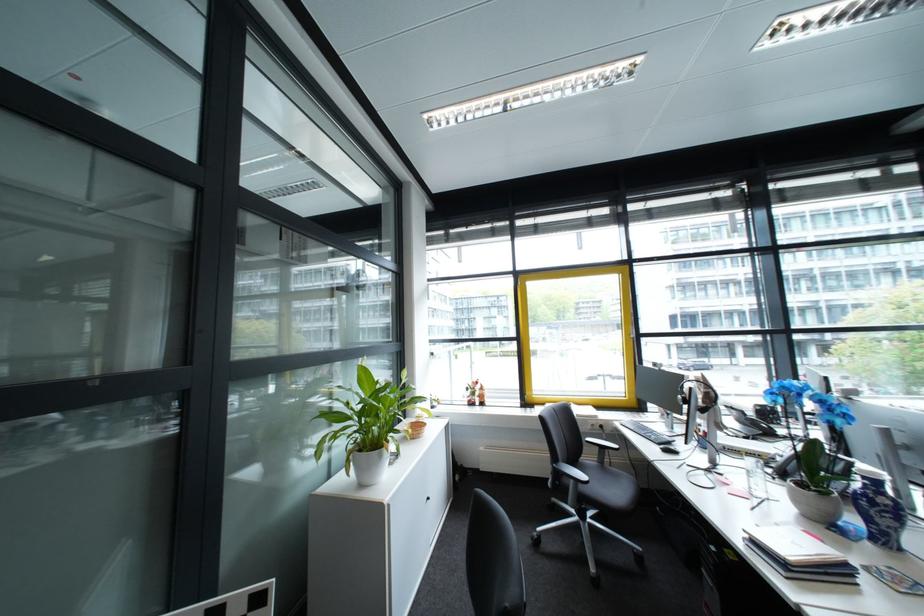
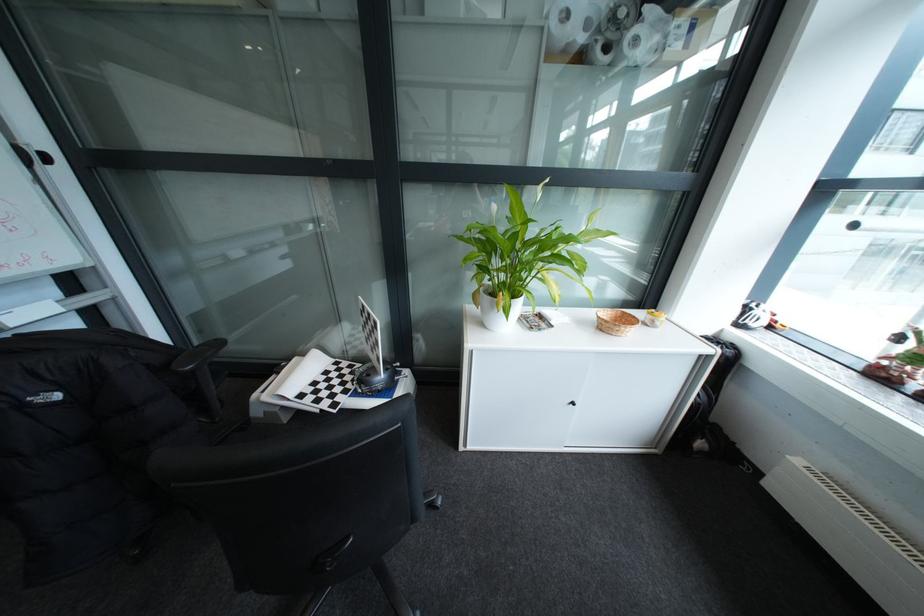
In the second image, find the point that corresponds to point 428,439 in the first image.

(614, 331)